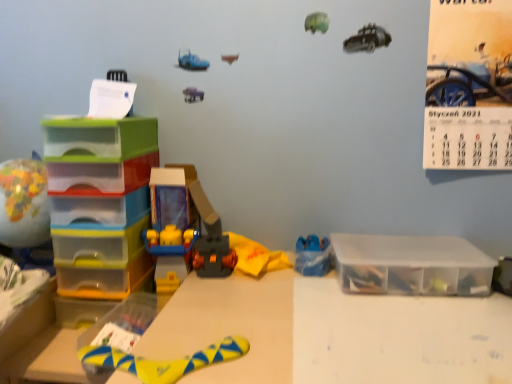
Question: Is clear plastic storage box at right spatially inside multicolored plastic globe at left, which ranks as the fourth toy in right-to-left order, or outside of it?

Choices:
 (A) inside
 (B) outside

Answer: (B)

Question: Considering the positions of clear plastic storage box at right and multicolored plastic globe at left, the 1th toy when ordered from left to right, in the image, is clear plastic storage box at right wider or thinner than multicolored plastic globe at left, the 1th toy when ordered from left to right,?

Choices:
 (A) wide
 (B) thin

Answer: (B)

Question: Estimate the real-world distances between objects in this image. Which object is closer to the yellow rubber toy at lower center, which is counted as the 2th toy, starting from the right?

Choices:
 (A) blue plastic toy at center-right, which ranks as the fourth toy in left-to-right order
 (B) clear plastic storage box at right
 (C) yellow paper calendar at upper right
 (D) translucent plastic drawers at left
 (E) multicolored plastic globe at left, which ranks as the fourth toy in right-to-left order

Answer: (D)

Question: Which object is positioned closest to the multicolored plastic globe at left, which ranks as the fourth toy in right-to-left order?

Choices:
 (A) clear plastic storage box at right
 (B) yellow rubber toy at lower center, which is counted as the 2th toy, starting from the right
 (C) blue plastic toy at center-right, which is counted as the first toy, starting from the right
 (D) translucent plastic drawers at left
 (E) yellow paper calendar at upper right

Answer: (D)